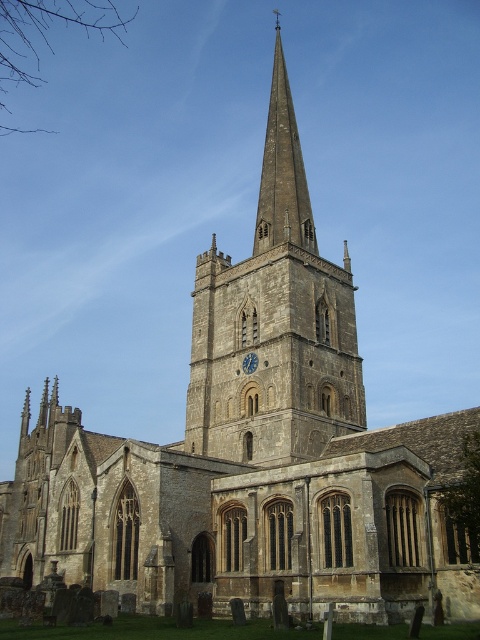
You are an architect analyzing the church structure. You need to determine which object is taller between the stone steeple at center and the blue painted wood clock at center. Based on the provided scene description, which one is taller?

The stone steeple at center is taller than the blue painted wood clock at center according to the description.

In the scene shown: You are an architect analyzing the church structure. You notice the stone steeple at center and the blue painted wood clock at center. Which of these two features has a greater width?

The stone steeple at center has a greater width than the blue painted wood clock at center according to the description.